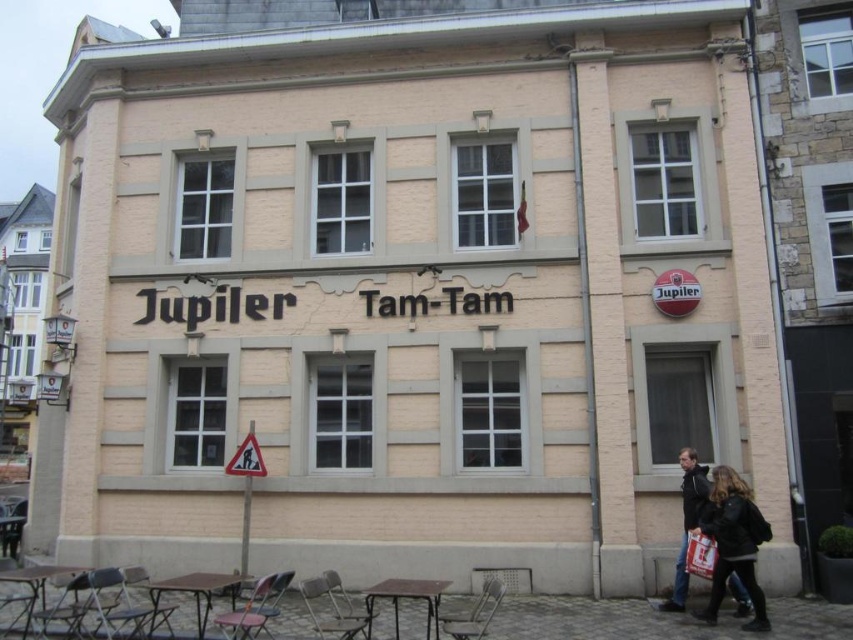
Question: Does black leather jacket at lower right appear on the left side of white paper bag at lower right?

Choices:
 (A) yes
 (B) no

Answer: (B)

Question: Can you confirm if black leather jacket at lower right is wider than dark brown leather jacket at lower right?

Choices:
 (A) no
 (B) yes

Answer: (A)

Question: Which object is the farthest from the dark brown leather jacket at lower right?

Choices:
 (A) black leather jacket at lower right
 (B) white paper bag at lower right

Answer: (A)

Question: Is black leather jacket at lower right to the left of white paper bag at lower right from the viewer's perspective?

Choices:
 (A) yes
 (B) no

Answer: (B)

Question: Which object appears closest to the camera in this image?

Choices:
 (A) dark brown leather jacket at lower right
 (B) black leather jacket at lower right

Answer: (B)

Question: Which point is closer to the camera taking this photo?

Choices:
 (A) (717, 609)
 (B) (705, 552)
 (C) (659, 609)

Answer: (B)